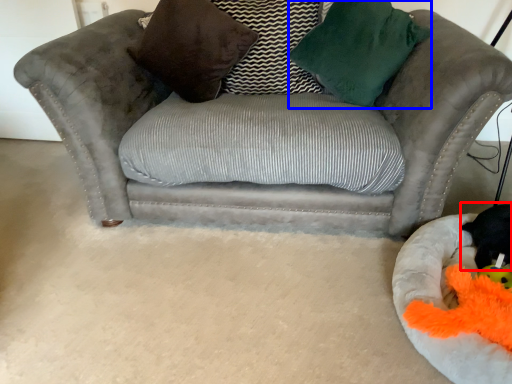
Question: Which object is further to the camera taking this photo, animal (highlighted by a red box) or throw pillow (highlighted by a blue box)?

Choices:
 (A) animal
 (B) throw pillow

Answer: (B)